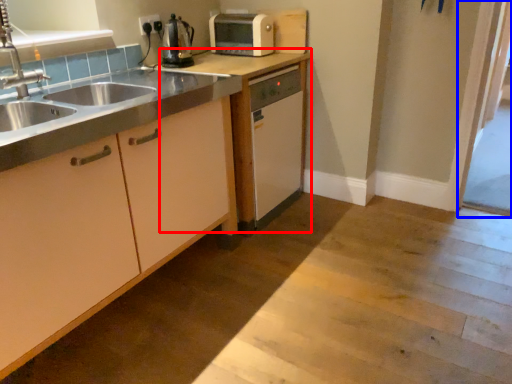
Question: Among these objects, which one is farthest to the camera, cabinetry (highlighted by a red box) or screen door (highlighted by a blue box)?

Choices:
 (A) cabinetry
 (B) screen door

Answer: (B)